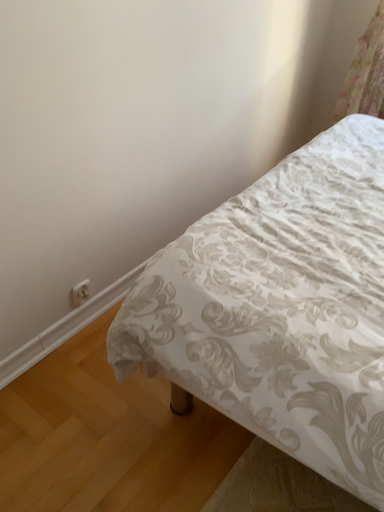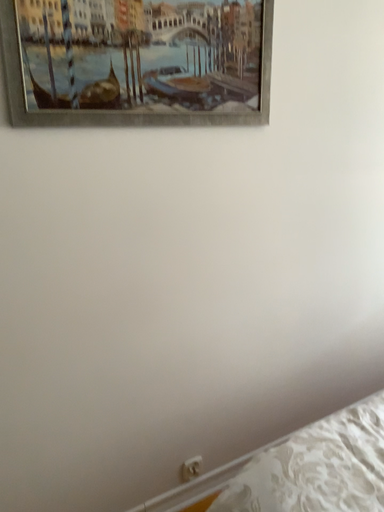
Question: Which way did the camera rotate in the video?

Choices:
 (A) rotated upward
 (B) rotated downward

Answer: (A)